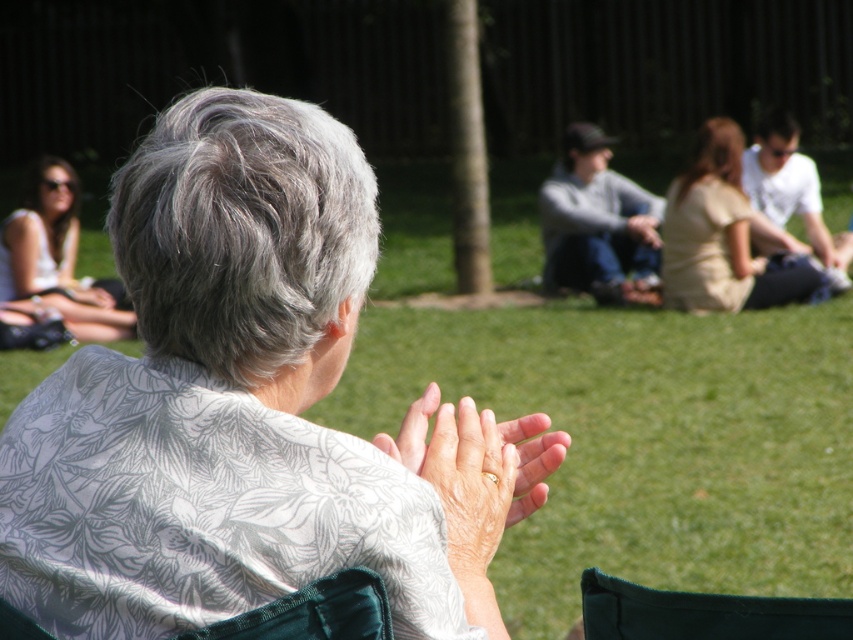
Question: Based on their relative distances, which object is nearer to the beige fabric dress at center?

Choices:
 (A) matte white shirt at upper left
 (B) gray cotton sweater at center

Answer: (B)

Question: Among these objects, which one is farthest from the camera?

Choices:
 (A) beige fabric dress at center
 (B) matte white shirt at upper left
 (C) gray cotton sweater at center

Answer: (C)

Question: Which point appears farthest from the camera in this image?

Choices:
 (A) (575, 220)
 (B) (717, 148)
 (C) (47, 296)

Answer: (A)

Question: Is gray cotton sweater at center above matte white shirt at upper left?

Choices:
 (A) no
 (B) yes

Answer: (B)

Question: Observing the image, what is the correct spatial positioning of gray cotton sweater at center in reference to matte white shirt at upper left?

Choices:
 (A) left
 (B) right

Answer: (B)

Question: Is beige fabric dress at center thinner than gray cotton sweater at center?

Choices:
 (A) yes
 (B) no

Answer: (B)